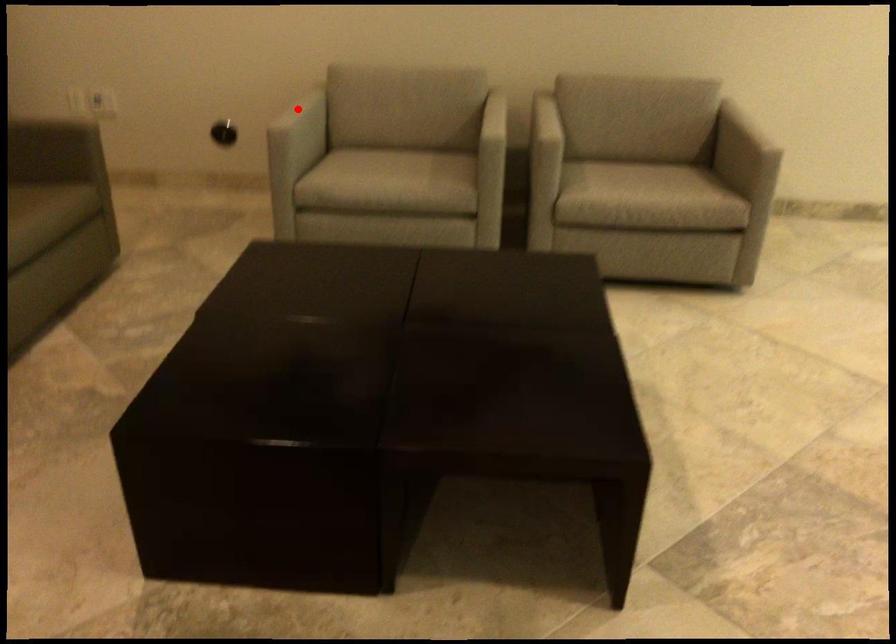
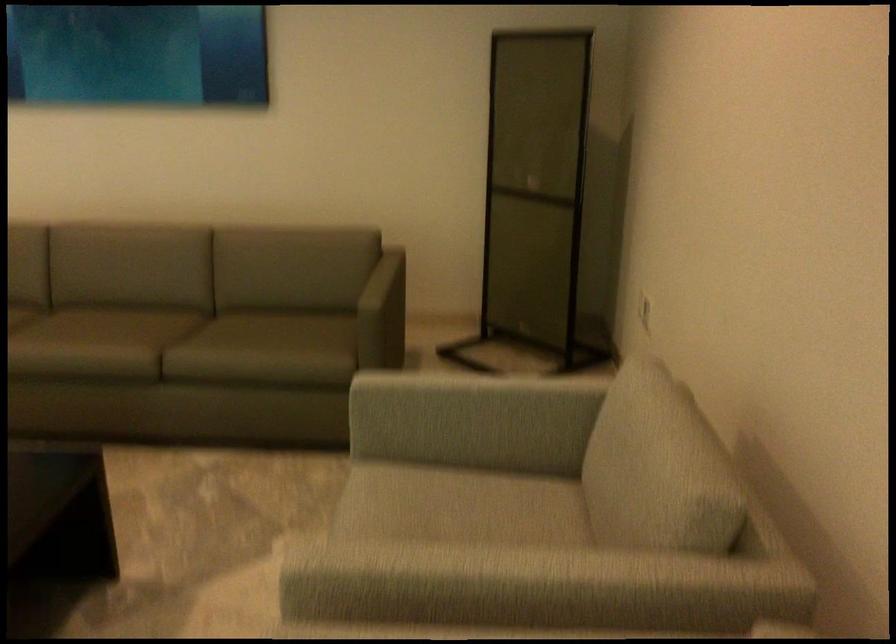
Find the pixel in the second image that matches the highlighted location in the first image.

(469, 399)